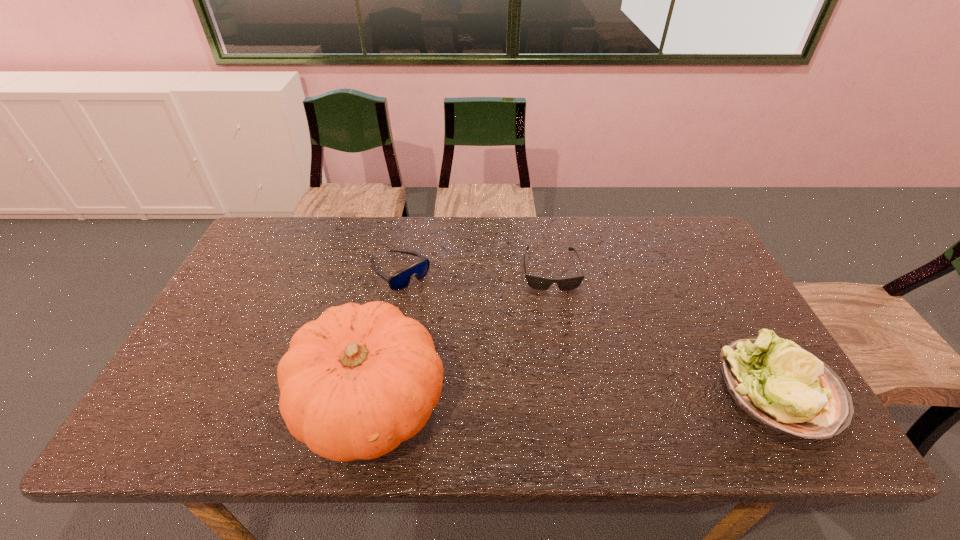
In the image, there is a desktop. Where is `free space at the left edge`? free space at the left edge is located at coordinates (220, 299).

Identify the location of vacant space at the right edge. The width and height of the screenshot is (960, 540). (712, 316).

In the image, there is a desktop. At what (x,y) coordinates should I click in order to perform the action: click on vacant space at the far left corner. Please return your answer as a coordinate pair (x, y). This screenshot has width=960, height=540. Looking at the image, I should click on (269, 251).

Where is `free space at the near left corner of the desktop`? The image size is (960, 540). free space at the near left corner of the desktop is located at coordinates (158, 402).

Locate an element on the screen. Image resolution: width=960 pixels, height=540 pixels. vacant space at the far right corner is located at coordinates (685, 229).

What are the coordinates of `free space between the right sunglasses and the third shortest object` in the screenshot? It's located at (665, 329).

Locate an element on the screen. The image size is (960, 540). vacant region between the shortest object and the pumpkin is located at coordinates (461, 337).

What are the coordinates of `free spot between the third shortest object and the tallest object` in the screenshot? It's located at (575, 396).

The image size is (960, 540). What are the coordinates of `vacant area that lies between the tallest object and the shorter sunglasses` in the screenshot? It's located at (x=461, y=337).

Identify the location of empty space that is in between the taller sunglasses and the rightmost object. (589, 330).